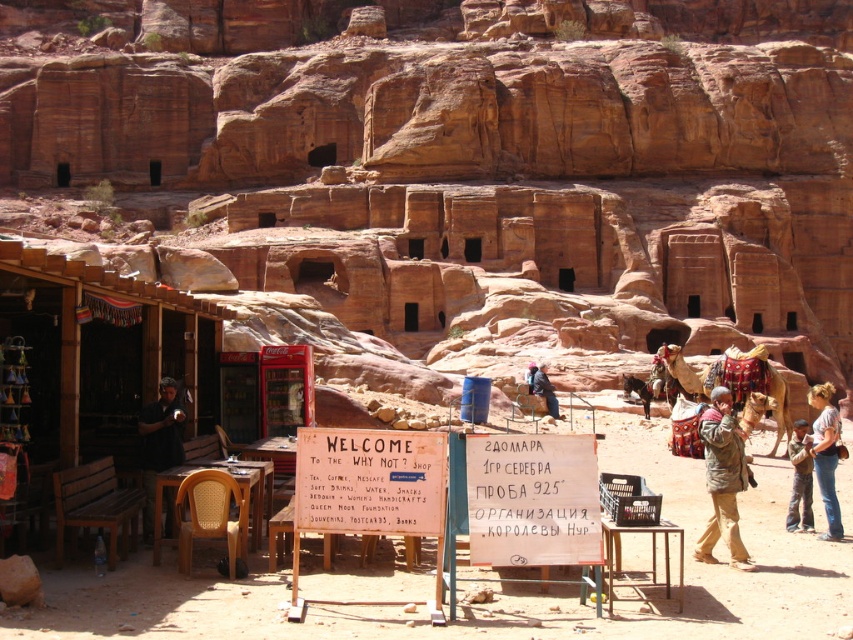
Question: Which of the following is the closest to the observer?

Choices:
 (A) white wooden sign at center
 (B) wooden signboard at center
 (C) dark brown leather jacket at left

Answer: (B)

Question: Estimate the real-world distances between objects in this image. Which object is closer to the wooden hut at left?

Choices:
 (A) brown fabric child at lower right
 (B) brown fuzzy jacket at lower right
 (C) wooden signboard at center

Answer: (C)

Question: Does brown fuzzy jacket at lower right have a lesser width compared to light brown hair at center?

Choices:
 (A) yes
 (B) no

Answer: (A)

Question: Does wooden hut at left have a greater width compared to brown fuzzy jacket at lower right?

Choices:
 (A) yes
 (B) no

Answer: (B)

Question: Is brown fabric child at lower right above dark brown leather jacket at center?

Choices:
 (A) no
 (B) yes

Answer: (A)

Question: Which of the following is the closest to the observer?

Choices:
 (A) wooden signboard at center
 (B) light brown hair at center

Answer: (A)